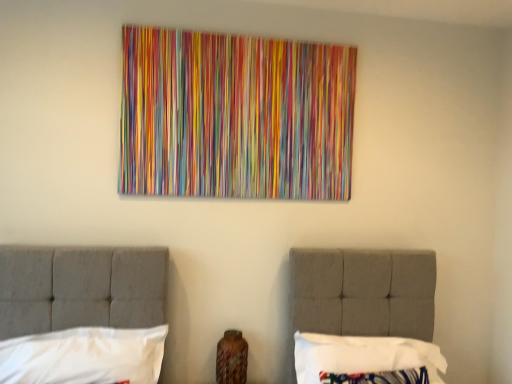
Locate an element on the screen. The height and width of the screenshot is (384, 512). white fabric pillow at lower right, placed as the second pillow when sorted from left to right is located at coordinates (362, 356).

What do you see at coordinates (362, 356) in the screenshot? I see `white fabric pillow at lower right, placed as the second pillow when sorted from left to right` at bounding box center [362, 356].

The height and width of the screenshot is (384, 512). What do you see at coordinates (84, 356) in the screenshot?
I see `white fabric pillow at lower left, placed as the 1th pillow when sorted from left to right` at bounding box center [84, 356].

Image resolution: width=512 pixels, height=384 pixels. I want to click on white fabric pillow at lower left, placed as the 1th pillow when sorted from left to right, so click(84, 356).

Locate an element on the screen. white fabric pillow at lower right, which is counted as the first pillow, starting from the right is located at coordinates (362, 356).

Looking at this image, does white fabric pillow at lower left, placed as the 1th pillow when sorted from left to right, appear on the right side of white fabric pillow at lower right, which is counted as the first pillow, starting from the right?

Incorrect, white fabric pillow at lower left, placed as the 1th pillow when sorted from left to right, is not on the right side of white fabric pillow at lower right, which is counted as the first pillow, starting from the right.

Which object is closer to the camera, white fabric pillow at lower left, placed as the 1th pillow when sorted from left to right, or white fabric pillow at lower right, placed as the second pillow when sorted from left to right?

white fabric pillow at lower left, placed as the 1th pillow when sorted from left to right.

Is point (152, 345) less distant than point (364, 366)?

Yes, it is.

From the image's perspective, is white fabric pillow at lower left, which is counted as the 2th pillow, starting from the right, above white fabric pillow at lower right, placed as the second pillow when sorted from left to right?

Yes.

From a real-world perspective, is white fabric pillow at lower left, placed as the 1th pillow when sorted from left to right, physically above white fabric pillow at lower right, placed as the second pillow when sorted from left to right?

Yes, from a real-world perspective, white fabric pillow at lower left, placed as the 1th pillow when sorted from left to right, is on top of white fabric pillow at lower right, placed as the second pillow when sorted from left to right.

Does white fabric pillow at lower left, placed as the 1th pillow when sorted from left to right, have a lesser width compared to white fabric pillow at lower right, which is counted as the first pillow, starting from the right?

Indeed, white fabric pillow at lower left, placed as the 1th pillow when sorted from left to right, has a lesser width compared to white fabric pillow at lower right, which is counted as the first pillow, starting from the right.

Considering the sizes of objects white fabric pillow at lower left, which is counted as the 2th pillow, starting from the right, and white fabric pillow at lower right, placed as the second pillow when sorted from left to right, in the image provided, who is taller, white fabric pillow at lower left, which is counted as the 2th pillow, starting from the right, or white fabric pillow at lower right, placed as the second pillow when sorted from left to right,?

white fabric pillow at lower right, placed as the second pillow when sorted from left to right, is taller.

Is white fabric pillow at lower left, which is counted as the 2th pillow, starting from the right, bigger or smaller than white fabric pillow at lower right, which is counted as the first pillow, starting from the right?

white fabric pillow at lower left, which is counted as the 2th pillow, starting from the right, is smaller than white fabric pillow at lower right, which is counted as the first pillow, starting from the right.

Is white fabric pillow at lower left, placed as the 1th pillow when sorted from left to right, not inside white fabric pillow at lower right, placed as the second pillow when sorted from left to right?

white fabric pillow at lower left, placed as the 1th pillow when sorted from left to right, lies outside white fabric pillow at lower right, placed as the second pillow when sorted from left to right,'s area.

Is white fabric pillow at lower left, which is counted as the 2th pillow, starting from the right, placed right next to white fabric pillow at lower right, placed as the second pillow when sorted from left to right?

No, white fabric pillow at lower left, which is counted as the 2th pillow, starting from the right, is not with white fabric pillow at lower right, placed as the second pillow when sorted from left to right.

Is white fabric pillow at lower left, which is counted as the 2th pillow, starting from the right, aimed at white fabric pillow at lower right, placed as the second pillow when sorted from left to right?

No.

Locate an element on the screen. pillow on the left of white fabric pillow at lower right, placed as the second pillow when sorted from left to right is located at coordinates (84, 356).

Considering the positions of objects white fabric pillow at lower right, which is counted as the first pillow, starting from the right, and white fabric pillow at lower left, placed as the 1th pillow when sorted from left to right, in the image provided, who is more to the right, white fabric pillow at lower right, which is counted as the first pillow, starting from the right, or white fabric pillow at lower left, placed as the 1th pillow when sorted from left to right,?

From the viewer's perspective, white fabric pillow at lower right, which is counted as the first pillow, starting from the right, appears more on the right side.

Is the position of white fabric pillow at lower right, placed as the second pillow when sorted from left to right, less distant than that of white fabric pillow at lower left, which is counted as the 2th pillow, starting from the right?

No, the depth of white fabric pillow at lower right, placed as the second pillow when sorted from left to right, is greater than that of white fabric pillow at lower left, which is counted as the 2th pillow, starting from the right.

Is point (331, 343) behind point (128, 349)?

Yes.

From the image's perspective, is white fabric pillow at lower right, which is counted as the first pillow, starting from the right, above or below white fabric pillow at lower left, which is counted as the 2th pillow, starting from the right?

Based on their image positions, white fabric pillow at lower right, which is counted as the first pillow, starting from the right, is located beneath white fabric pillow at lower left, which is counted as the 2th pillow, starting from the right.

From a real-world perspective, which object stands above the other?

white fabric pillow at lower left, placed as the 1th pillow when sorted from left to right, is physically above.

Which of these two, white fabric pillow at lower right, which is counted as the first pillow, starting from the right, or white fabric pillow at lower left, which is counted as the 2th pillow, starting from the right, is wider?

Wider between the two is white fabric pillow at lower right, which is counted as the first pillow, starting from the right.

Considering the relative sizes of white fabric pillow at lower right, which is counted as the first pillow, starting from the right, and white fabric pillow at lower left, placed as the 1th pillow when sorted from left to right, in the image provided, is white fabric pillow at lower right, which is counted as the first pillow, starting from the right, shorter than white fabric pillow at lower left, placed as the 1th pillow when sorted from left to right,?

No, white fabric pillow at lower right, which is counted as the first pillow, starting from the right, is not shorter than white fabric pillow at lower left, placed as the 1th pillow when sorted from left to right.

Based on their sizes in the image, would you say white fabric pillow at lower right, which is counted as the first pillow, starting from the right, is bigger or smaller than white fabric pillow at lower left, placed as the 1th pillow when sorted from left to right?

white fabric pillow at lower right, which is counted as the first pillow, starting from the right, is bigger than white fabric pillow at lower left, placed as the 1th pillow when sorted from left to right.

Can we say white fabric pillow at lower right, placed as the second pillow when sorted from left to right, lies outside white fabric pillow at lower left, placed as the 1th pillow when sorted from left to right?

Yes, white fabric pillow at lower right, placed as the second pillow when sorted from left to right, is located beyond the bounds of white fabric pillow at lower left, placed as the 1th pillow when sorted from left to right.

Are white fabric pillow at lower right, which is counted as the first pillow, starting from the right, and white fabric pillow at lower left, which is counted as the 2th pillow, starting from the right, far apart?

That's not correct — white fabric pillow at lower right, which is counted as the first pillow, starting from the right, is a little close to white fabric pillow at lower left, which is counted as the 2th pillow, starting from the right.

Is white fabric pillow at lower right, placed as the second pillow when sorted from left to right, looking in the opposite direction of white fabric pillow at lower left, placed as the 1th pillow when sorted from left to right?

No, white fabric pillow at lower right, placed as the second pillow when sorted from left to right, is not facing the opposite direction of white fabric pillow at lower left, placed as the 1th pillow when sorted from left to right.

Where is `pillow that is below the white fabric pillow at lower left, which is counted as the 2th pillow, starting from the right (from the image's perspective)`? pillow that is below the white fabric pillow at lower left, which is counted as the 2th pillow, starting from the right (from the image's perspective) is located at coordinates (362, 356).

Find the location of `pillow that appears in front of the white fabric pillow at lower right, placed as the second pillow when sorted from left to right`. pillow that appears in front of the white fabric pillow at lower right, placed as the second pillow when sorted from left to right is located at coordinates (84, 356).

Locate an element on the screen. The image size is (512, 384). pillow behind the white fabric pillow at lower left, placed as the 1th pillow when sorted from left to right is located at coordinates (362, 356).